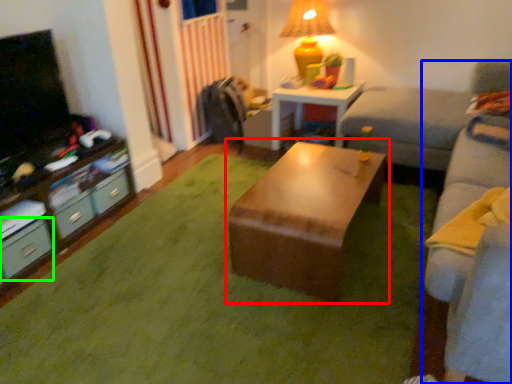
Question: Based on their relative distances, which object is farther from table (highlighted by a red box)? Choose from studio couch (highlighted by a blue box) and drawer (highlighted by a green box).

Choices:
 (A) studio couch
 (B) drawer

Answer: (B)